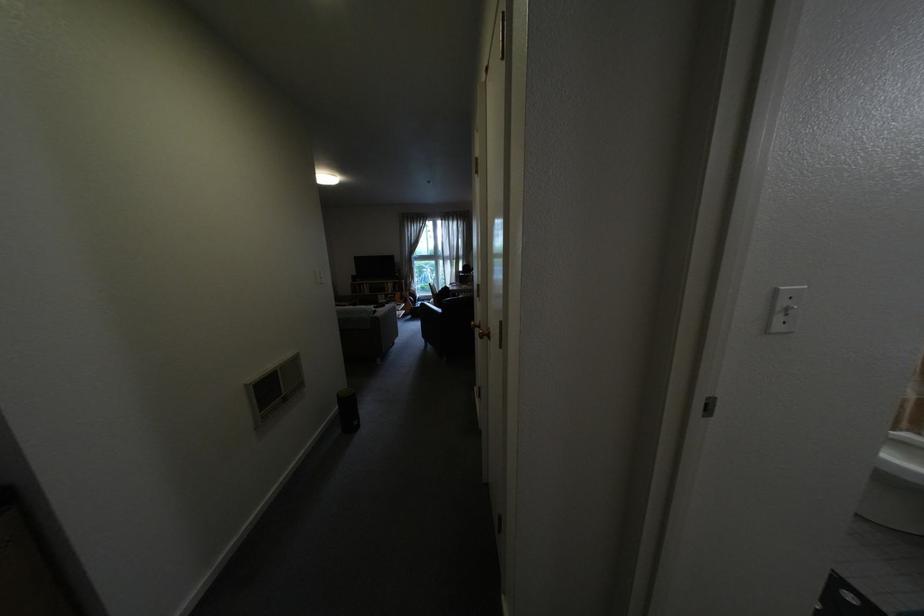
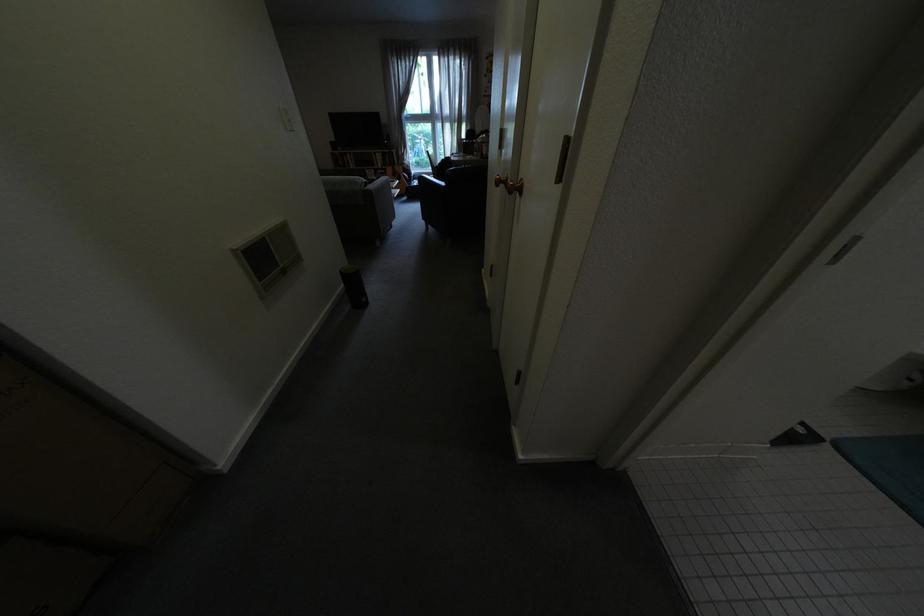
What movement of the cameraman would produce the second image?

The cameraman moved toward left, forward.